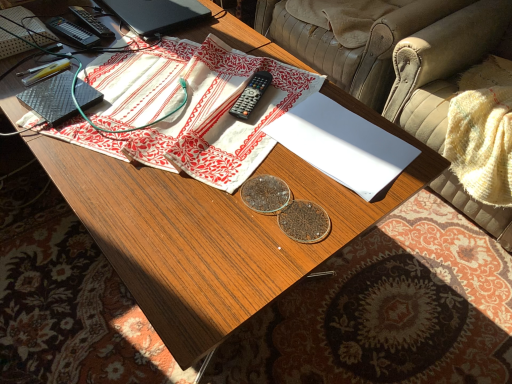
Locate an element on the screen. The height and width of the screenshot is (384, 512). empty space that is in between black matte laptop at upper left and black plastic remote at center is located at coordinates (206, 60).